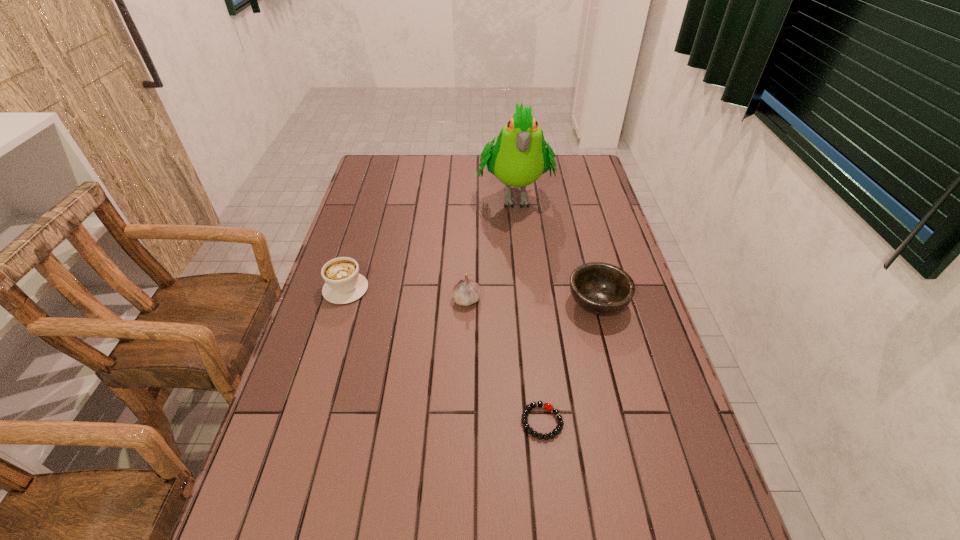
Locate an element on the screen. vacant area at the far right corner of the desktop is located at coordinates (567, 171).

Where is `free point between the bracelet and the tallest object`? This screenshot has height=540, width=960. free point between the bracelet and the tallest object is located at coordinates (528, 308).

The height and width of the screenshot is (540, 960). Find the location of `vacant region between the garlic and the tallest object`. vacant region between the garlic and the tallest object is located at coordinates (491, 247).

You are a GUI agent. You are given a task and a screenshot of the screen. Output one action in this format:
    pyautogui.click(x=<x>, y=<y>)
    Task: Click on the vacant space in between the bowl and the second tallest object
    This screenshot has width=960, height=540.
    Given the screenshot: What is the action you would take?
    pyautogui.click(x=532, y=301)

This screenshot has height=540, width=960. I want to click on empty space that is in between the bowl and the fourth shortest object, so click(532, 301).

In order to click on free space between the leftmost object and the parakeet in this screenshot , I will do `click(430, 241)`.

Identify the location of vacant space that is in between the parakeet and the shortest object. The height and width of the screenshot is (540, 960). (528, 308).

Find the location of a particular element. Image resolution: width=960 pixels, height=540 pixels. free point between the cappuccino and the bracelet is located at coordinates (444, 355).

Locate an element on the screen. free spot between the bracelet and the leftmost object is located at coordinates (444, 355).

Select which object appears as the fourth closest to the leftmost object. Please provide its 2D coordinates. Your answer should be formatted as a tuple, i.e. [(x, y)], where the tuple contains the x and y coordinates of a point satisfying the conditions above.

[(599, 288)]